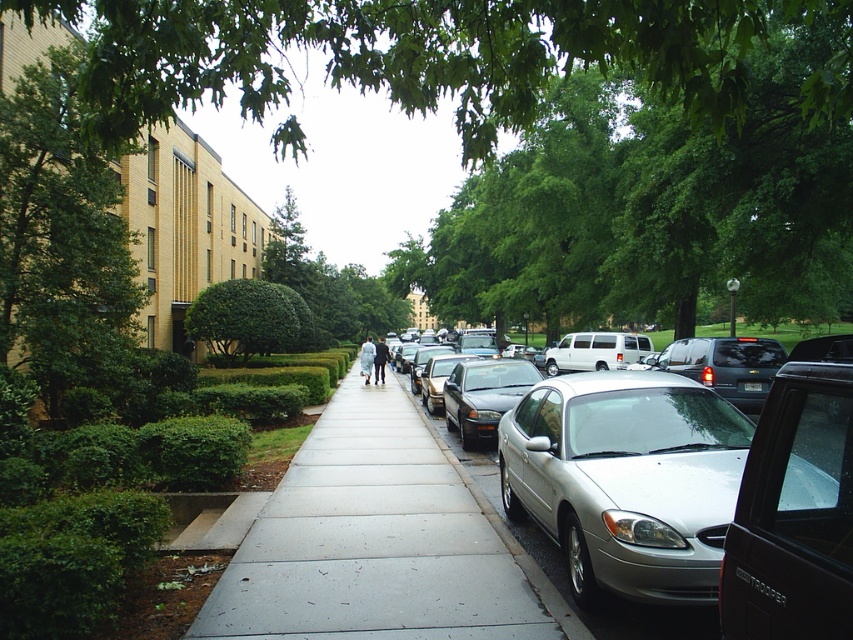
Can you confirm if shiny silver sedan at center right is positioned below dark blue suit at center?

Yes, shiny silver sedan at center right is below dark blue suit at center.

Who is more distant from viewer, (445, 385) or (376, 371)?

Positioned behind is point (376, 371).

Does point (463, 381) come closer to viewer compared to point (379, 355)?

Yes, it is.

This screenshot has width=853, height=640. In order to click on shiny silver sedan at center right in this screenshot , I will do `click(483, 396)`.

Who is positioned more to the left, green leafy bush at center or dark blue suit at center?

green leafy bush at center is more to the left.

Which is behind, point (292, 310) or point (383, 365)?

Point (383, 365)

Locate an element on the screen. green leafy bush at center is located at coordinates (247, 317).

Does green leafy tree at upper center appear on the right side of dark blue suit at center?

Incorrect, green leafy tree at upper center is not on the right side of dark blue suit at center.

Does green leafy tree at upper center appear on the left side of dark blue suit at center?

Yes, green leafy tree at upper center is to the left of dark blue suit at center.

Between point (180, 68) and point (375, 353), which one is positioned behind?

The point (375, 353) is behind.

At what (x,y) coordinates should I click in order to perform the action: click on green leafy tree at upper center. Please return your answer as a coordinate pair (x, y). The width and height of the screenshot is (853, 640). Looking at the image, I should click on (438, 54).